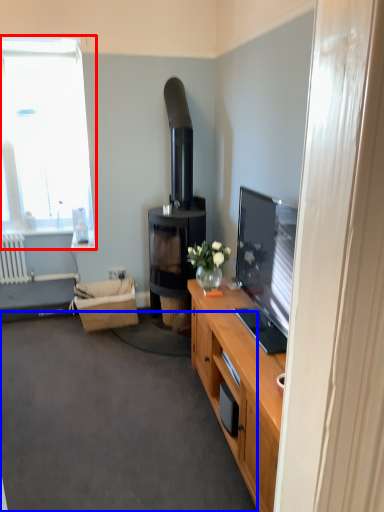
Question: Which object is further to the camera taking this photo, window (highlighted by a red box) or plain (highlighted by a blue box)?

Choices:
 (A) window
 (B) plain

Answer: (A)